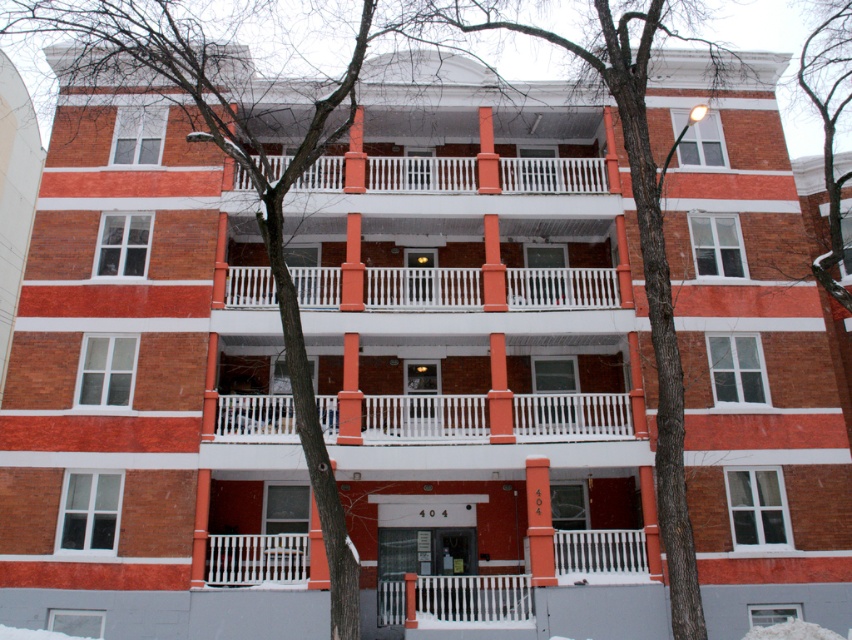
The image size is (852, 640). What do you see at coordinates (424, 419) in the screenshot?
I see `white painted wood balcony at center` at bounding box center [424, 419].

Who is more distant from viewer, (468, 428) or (556, 179)?

Point (556, 179)

This screenshot has height=640, width=852. Describe the element at coordinates (424, 419) in the screenshot. I see `white painted wood balcony at center` at that location.

You are a GUI agent. You are given a task and a screenshot of the screen. Output one action in this format:
    pyautogui.click(x=<x>, y=<y>)
    Task: Click on the white painted wood balcony at center
    The image size is (852, 640).
    Given the screenshot: What is the action you would take?
    pyautogui.click(x=424, y=419)

Is smooth bark tree at center below white wooden railing at center?

No, smooth bark tree at center is not below white wooden railing at center.

Looking at this image, is smooth bark tree at center bigger than white wooden railing at center?

Indeed, smooth bark tree at center has a larger size compared to white wooden railing at center.

The width and height of the screenshot is (852, 640). Find the location of `smooth bark tree at center`. smooth bark tree at center is located at coordinates (642, 266).

Between smooth bark tree at center and bare branches at upper center, which one is positioned higher?

bare branches at upper center is higher up.

Is smooth bark tree at center to the left of bare branches at upper center from the viewer's perspective?

Correct, you'll find smooth bark tree at center to the left of bare branches at upper center.

You are a GUI agent. You are given a task and a screenshot of the screen. Output one action in this format:
    pyautogui.click(x=<x>, y=<y>)
    Task: Click on the smooth bark tree at center
    
    Given the screenshot: What is the action you would take?
    pyautogui.click(x=642, y=266)